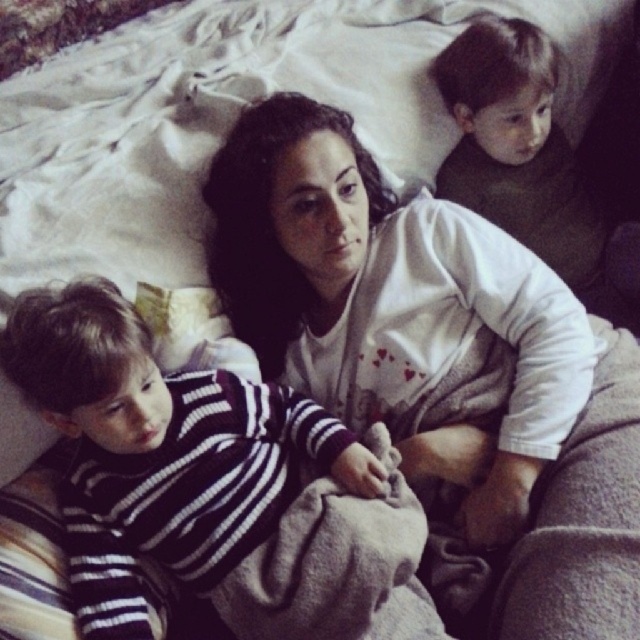
From the picture: What is located at the coordinates point (x=388, y=296)?

The white soft sweater at center is located at point (x=388, y=296).

You are organizing a closet and need to place the white soft sweater at center and the dark green sweater at upper right. According to the image, which sweater is positioned higher up?

The dark green sweater at upper right is positioned higher up than the white soft sweater at center.

From the picture: You are a delivery robot positioned at the entrance of the room. You need to place a package on the white soft sweater at center. Can you reach it from your current position?

The white soft sweater at center is 1.10 meters away from the viewer, so the delivery robot can reach it from its current position as it is within a manageable distance.